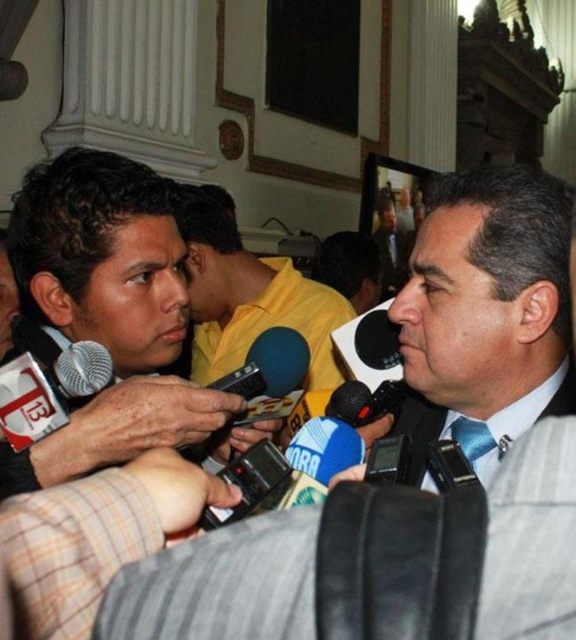
You are a photographer trying to adjust your camera settings. You notice the matte black camera at center and the yellow matte shirt at center. Which object is positioned more to the right side of the scene?

The matte black camera at center is positioned to the right of the yellow matte shirt at center, so the matte black camera at center is more to the right side of the scene.

You are standing at the point marked as point (66, 253) in the image. You want to move to the nearest exit, which is 20 feet away from your current position. Can you safely reach it without moving more than 20 feet?

The distance between point (66, 253) and the viewer is 17.70 feet, which is less than 20 feet. Therefore, you can safely reach the exit without exceeding the 20 feet limit.

You are a photographer standing at the camera position. You want to take a closeup shot of the black plastic handheld device at center. Can you reach it without moving from your current position?

The black plastic handheld device at center is 2.98 meters away from camera. Since this distance is within a typical photographer reach, you can take the closeup shot without moving from your current position.